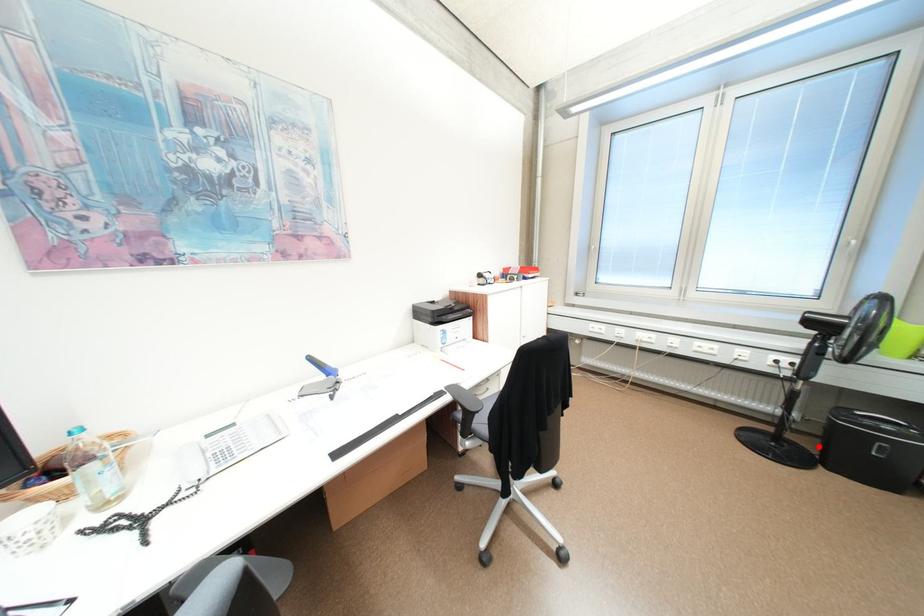
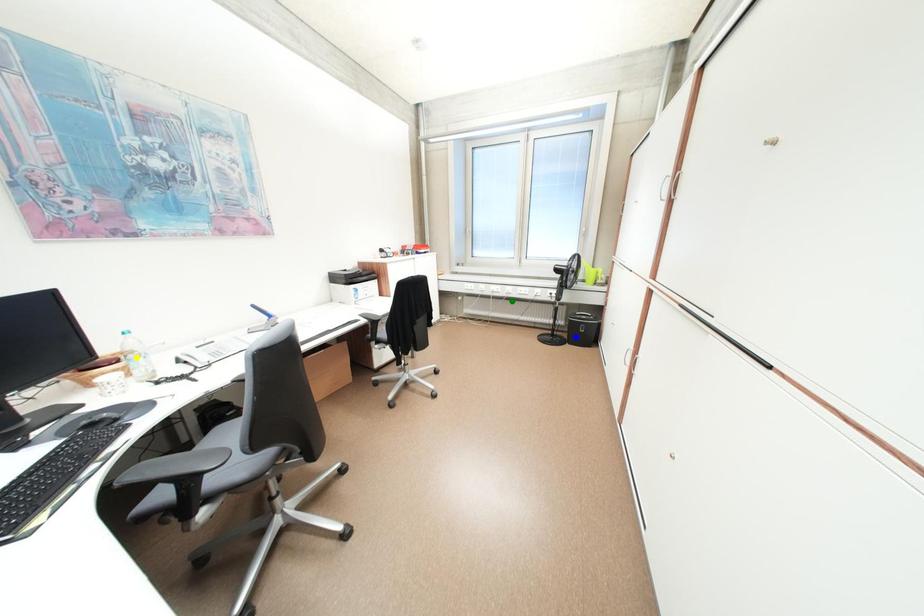
Question: I am providing you with two images of the same scene from different viewpoints. A red point is marked on the first image. You are given multiple points on the second image. Which point in image 2 represents the same 3d spot as the red point in image 1?

Choices:
 (A) blue point
 (B) yellow point
 (C) green point

Answer: (A)